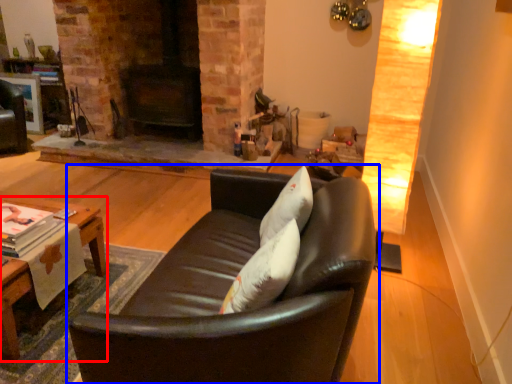
Question: Among these objects, which one is farthest to the camera, table (highlighted by a red box) or studio couch (highlighted by a blue box)?

Choices:
 (A) table
 (B) studio couch

Answer: (A)